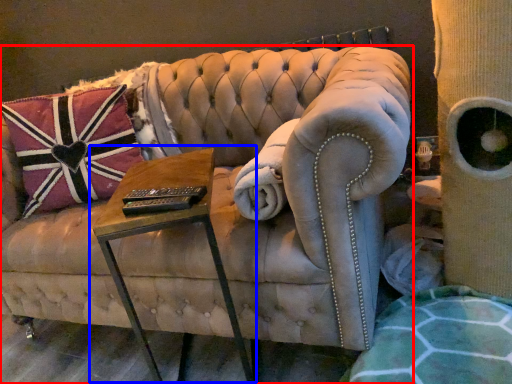
Question: Which point is further to the camera, furniture (highlighted by a red box) or table (highlighted by a blue box)?

Choices:
 (A) furniture
 (B) table

Answer: (B)